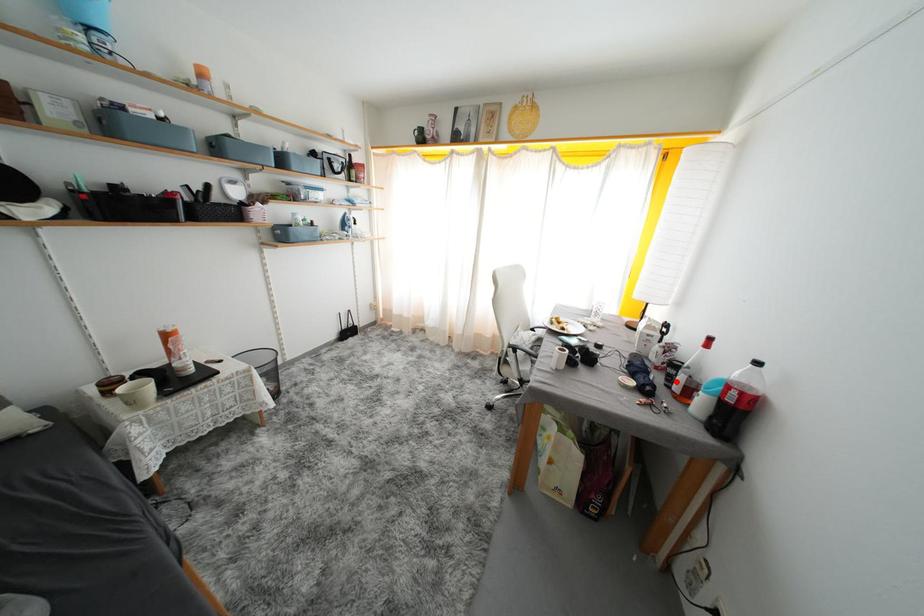
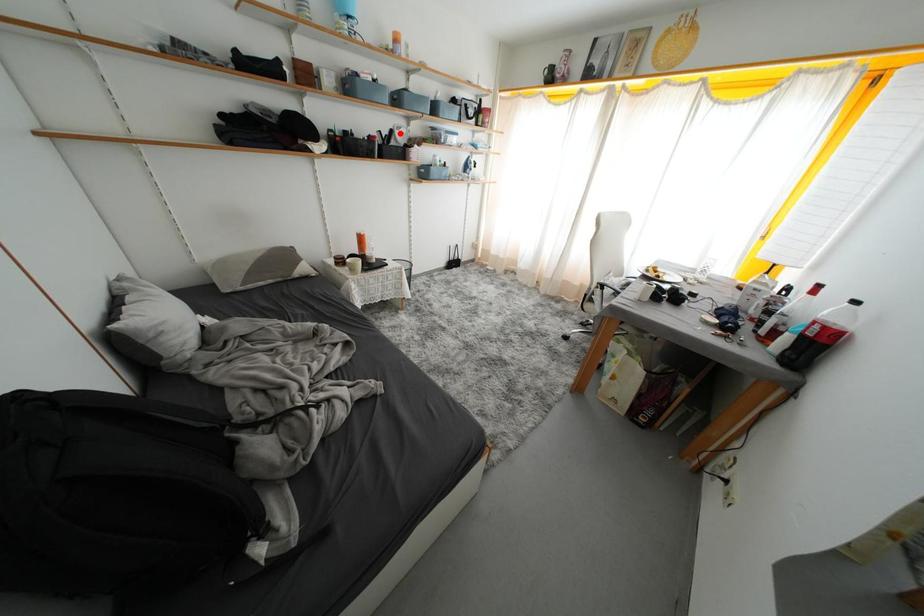
I am providing you with two images of the same scene from different viewpoints. A red point is marked on the first image and another point is marked on the second image. Is the red point in image1 aligned with the point shown in image2?

No